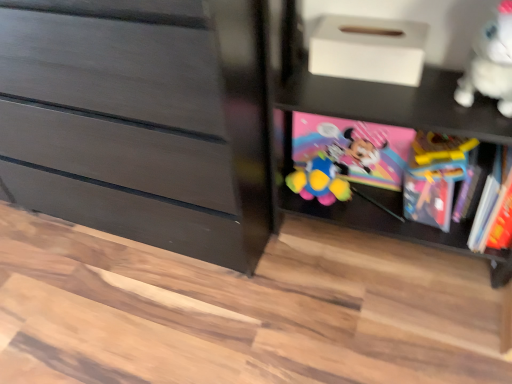
Question: Looking at the image, does black matte shelf at lower right seem bigger or smaller compared to pink matte minnie mouse book at center, arranged as the second book when viewed from the right?

Choices:
 (A) big
 (B) small

Answer: (A)

Question: From the image's perspective, relative to pink matte minnie mouse book at center, which is the first book from left to right, is black matte shelf at lower right above or below?

Choices:
 (A) above
 (B) below

Answer: (A)

Question: Estimate the real-world distances between objects in this image. Which object is farther from the matte black dresser at left?

Choices:
 (A) white matte shoe box at upper center
 (B) pink matte minnie mouse book at center, arranged as the second book when viewed from the right
 (C) black matte shelf at lower right
 (D) translucent plastic book at right, which ranks as the first book in right-to-left order
 (E) white plush toy at upper right

Answer: (E)

Question: Estimate the real-world distances between objects in this image. Which object is closer to the white plush toy at upper right?

Choices:
 (A) white matte shoe box at upper center
 (B) black matte shelf at lower right
 (C) matte black dresser at left
 (D) translucent plastic book at right, which is the second book from left to right
 (E) pink matte minnie mouse book at center, which is the first book from left to right

Answer: (B)